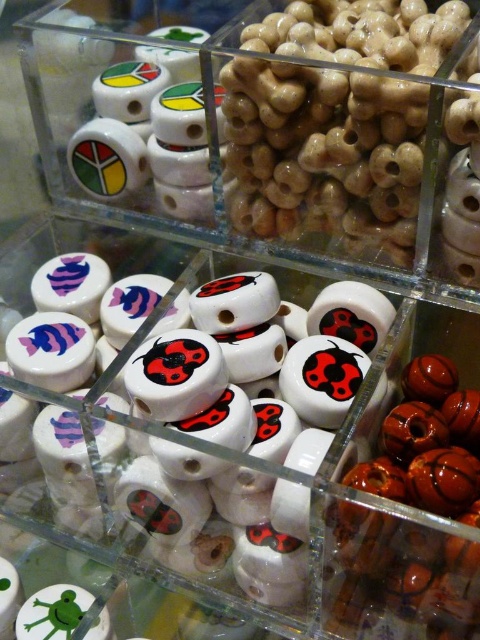
Measure the distance between white glossy beads at center and white glossy bead at center.

The distance of white glossy beads at center from white glossy bead at center is 7.39 inches.

Where is `white glossy beads at center`? white glossy beads at center is located at coordinates (228, 477).

The image size is (480, 640). I want to click on white glossy beads at center, so click(x=228, y=477).